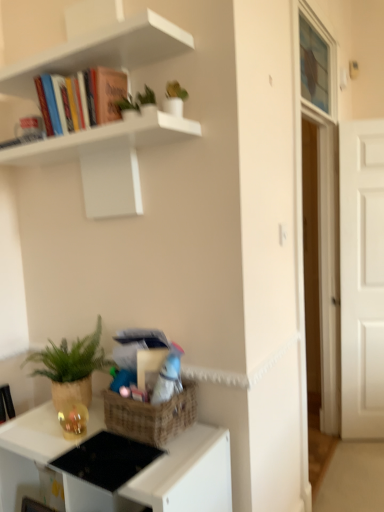
The height and width of the screenshot is (512, 384). Describe the element at coordinates (187, 474) in the screenshot. I see `matte black desk at lower left` at that location.

The image size is (384, 512). What do you see at coordinates (317, 63) in the screenshot?
I see `translucent glass window screen at upper right` at bounding box center [317, 63].

Locate an element on the screen. The image size is (384, 512). white matte door at right is located at coordinates (362, 278).

Between white matte shelf at upper left and green woven basket at lower left, which one has larger width?

Wider between the two is green woven basket at lower left.

Measure the distance from white matte shelf at upper left to green woven basket at lower left.

white matte shelf at upper left is 24.81 inches away from green woven basket at lower left.

Who is more distant, white matte shelf at upper left or green woven basket at lower left?

green woven basket at lower left is further away from the camera.

How many degrees apart are the facing directions of white matte shelf at upper left and green woven basket at lower left?

1.94 degrees.

Considering the sizes of objects white matte shelf at upper left and white matte door at right in the image provided, who is smaller, white matte shelf at upper left or white matte door at right?

white matte door at right is smaller.

At what (x,y) coordinates should I click in order to perform the action: click on shelf to the left of white matte door at right. Please return your answer as a coordinate pair (x, y). The width and height of the screenshot is (384, 512). Looking at the image, I should click on (106, 159).

Would you say white matte shelf at upper left is a long distance from white matte door at right?

Yes, white matte shelf at upper left and white matte door at right are quite far apart.

In the image, is matte black desk at lower left on the left side or the right side of white matte door at right?

Clearly, matte black desk at lower left is on the left of white matte door at right in the image.

Is matte black desk at lower left oriented away from white matte door at right?

Yes, matte black desk at lower left is positioned with its back facing white matte door at right.

Is point (188, 501) closer to camera compared to point (368, 422)?

Yes, it is in front of point (368, 422).

Can you see white matte door at right touching white matte shelf at upper left?

They are not placed beside each other.

Can we say white matte door at right lies outside white matte shelf at upper left?

Indeed, white matte door at right is completely outside white matte shelf at upper left.

Is white matte door at right smaller than white matte shelf at upper left?

Yes.

Can matte black desk at lower left be found inside green woven basket at lower left?

No.

Is green woven basket at lower left positioned far away from matte black desk at lower left?

No, green woven basket at lower left is in close proximity to matte black desk at lower left.

Considering the relative sizes of green woven basket at lower left and matte black desk at lower left in the image provided, is green woven basket at lower left smaller than matte black desk at lower left?

Yes, green woven basket at lower left is smaller than matte black desk at lower left.

Considering the sizes of objects white matte door at right and green woven basket at lower left in the image provided, who is wider, white matte door at right or green woven basket at lower left?

green woven basket at lower left is wider.

From the image's perspective, is white matte door at right over green woven basket at lower left?

Yes, from the image's perspective, white matte door at right is above green woven basket at lower left.

From a real-world perspective, which object rests below the other?

green woven basket at lower left.

Is white matte door at right oriented away from green woven basket at lower left?

That's not correct — white matte door at right is not looking away from green woven basket at lower left.

Can you confirm if green woven basket at lower left is taller than white matte shelf at upper left?

Incorrect, the height of green woven basket at lower left is not larger of that of white matte shelf at upper left.

I want to click on shelf in front of the green woven basket at lower left, so click(x=106, y=159).

Which object is closer to the camera taking this photo, green woven basket at lower left or white matte shelf at upper left?

Positioned in front is white matte shelf at upper left.

You are a GUI agent. You are given a task and a screenshot of the screen. Output one action in this format:
    pyautogui.click(x=<x>, y=<y>)
    Task: Click on the houseplant lying behind the white matte shelf at upper left
    Image resolution: width=384 pixels, height=512 pixels.
    Given the screenshot: What is the action you would take?
    click(x=71, y=367)

You are a GUI agent. You are given a task and a screenshot of the screen. Output one action in this format:
    pyautogui.click(x=<x>, y=<y>)
    Task: Click on the shelf above the white matte door at right (from a real-world perspective)
    Image resolution: width=384 pixels, height=512 pixels.
    Given the screenshot: What is the action you would take?
    pyautogui.click(x=106, y=159)

Which object lies further to the anchor point matte black desk at lower left, green woven basket at lower left or white matte shelf at upper left?

The object further to matte black desk at lower left is white matte shelf at upper left.

Based on their spatial positions, is white matte shelf at upper left or translucent glass window screen at upper right further from white matte door at right?

Among the two, white matte shelf at upper left is located further to white matte door at right.

From the image, which object appears to be nearer to white matte shelf at upper left, white matte door at right or green woven basket at lower left?

The object closer to white matte shelf at upper left is green woven basket at lower left.

Based on their spatial positions, is white matte shelf at upper left or white matte door at right closer to matte black desk at lower left?

Among the two, white matte shelf at upper left is located nearer to matte black desk at lower left.

From the image, which object appears to be farther from white matte shelf at upper left, white matte door at right or translucent glass window screen at upper right?

white matte door at right is further to white matte shelf at upper left.

Considering their positions, is white matte door at right positioned closer to matte black desk at lower left than white matte shelf at upper left?

Based on the image, white matte shelf at upper left appears to be nearer to matte black desk at lower left.

Considering their positions, is green woven basket at lower left positioned closer to translucent glass window screen at upper right than white matte door at right?

white matte door at right lies closer to translucent glass window screen at upper right than the other object.

Which object lies nearer to the anchor point green woven basket at lower left, matte black desk at lower left or white matte shelf at upper left?

matte black desk at lower left.

Find the location of `shelf between translucent glass window screen at upper right and matte black desk at lower left in the vertical direction`. shelf between translucent glass window screen at upper right and matte black desk at lower left in the vertical direction is located at coordinates (106, 159).

You are a GUI agent. You are given a task and a screenshot of the screen. Output one action in this format:
    pyautogui.click(x=<x>, y=<y>)
    Task: Click on the window screen between green woven basket at lower left and white matte door at right from left to right
    The image size is (384, 512).
    Given the screenshot: What is the action you would take?
    pyautogui.click(x=317, y=63)

This screenshot has height=512, width=384. I want to click on window screen between white matte shelf at upper left and white matte door at right in the horizontal direction, so click(317, 63).

Find the location of a particular element. This screenshot has height=512, width=384. shelf between green woven basket at lower left and white matte door at right is located at coordinates tap(106, 159).